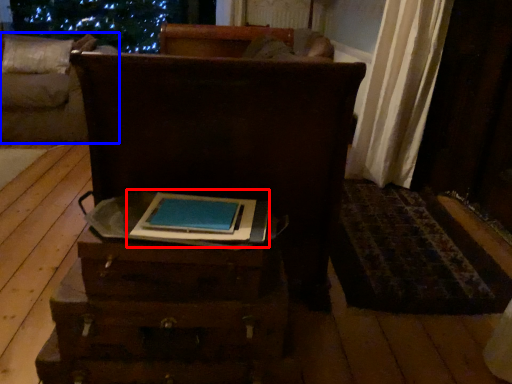
Question: Among these objects, which one is farthest to the camera, book (highlighted by a red box) or furniture (highlighted by a blue box)?

Choices:
 (A) book
 (B) furniture

Answer: (B)